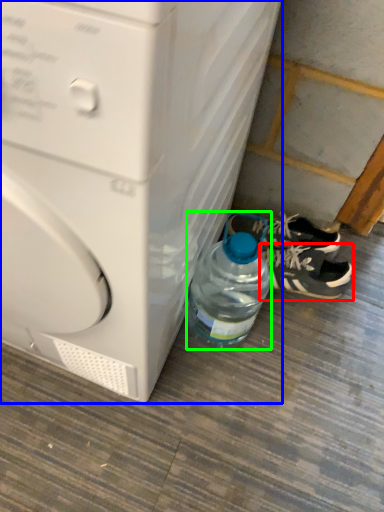
Question: Which object is positioned closest to footwear (highlighted by a red box)? Select from washing machine (highlighted by a blue box) and bottle (highlighted by a green box).

Choices:
 (A) washing machine
 (B) bottle

Answer: (B)